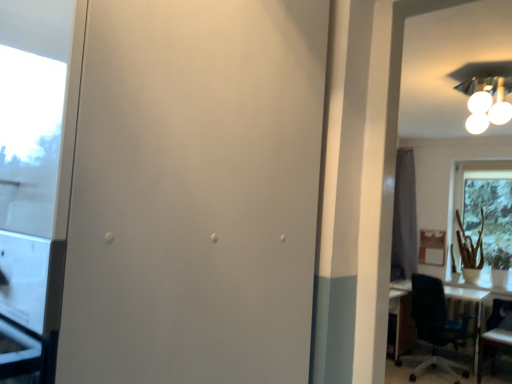
You are a GUI agent. You are given a task and a screenshot of the screen. Output one action in this format:
    pyautogui.click(x=<x>, y=<y>)
    Task: Click on the white glossy light fixture at upper right
    This screenshot has width=512, height=384.
    Given the screenshot: What is the action you would take?
    pyautogui.click(x=486, y=101)

Measure the distance between point (464, 234) and camera.

The depth of point (464, 234) is 18.05 feet.

You are a GUI agent. You are given a task and a screenshot of the screen. Output one action in this format:
    pyautogui.click(x=<x>, y=<y>)
    Task: Click on the black plastic chair at right, the first chair when ordered from left to right
    This screenshot has height=384, width=512.
    Given the screenshot: What is the action you would take?
    pyautogui.click(x=435, y=325)

This screenshot has width=512, height=384. What do you see at coordinates (496, 337) in the screenshot?
I see `wooden chair at right, the first chair positioned from the right` at bounding box center [496, 337].

This screenshot has height=384, width=512. Identify the location of white matte screen door at center. (195, 192).

Is white glossy light fixture at upper right surrounding wooden chair at right, arranged as the second chair when viewed from the left?

Actually, wooden chair at right, arranged as the second chair when viewed from the left, is outside white glossy light fixture at upper right.

Looking at this image, which object is wider, white glossy light fixture at upper right or wooden chair at right, the first chair positioned from the right?

With larger width is wooden chair at right, the first chair positioned from the right.

In the scene shown: Is white glossy light fixture at upper right to the left or to the right of wooden chair at right, arranged as the second chair when viewed from the left, in the image?

white glossy light fixture at upper right is positioned on wooden chair at right, arranged as the second chair when viewed from the left,'s left side.

From the image's perspective, does white glossy light fixture at upper right appear lower than wooden chair at right, arranged as the second chair when viewed from the left?

No, from the image's perspective, white glossy light fixture at upper right is not below wooden chair at right, arranged as the second chair when viewed from the left.

From a real-world perspective, which object rests below the other?

green matte plant at right, from a real-world perspective.

Which is in front, point (462, 234) or point (486, 103)?

The point (486, 103) is in front.

Can we say green matte plant at right lies outside white glossy light fixture at upper right?

green matte plant at right lies outside white glossy light fixture at upper right's area.

From a real-world perspective, is white glossy light fixture at upper right positioned over green matte plant at right based on gravity?

Correct, in the physical world, white glossy light fixture at upper right is higher than green matte plant at right.

Can you confirm if white glossy light fixture at upper right is shorter than green matte plant at right?

Yes.

Is white glossy light fixture at upper right at the right side of green matte plant at right?

Incorrect, white glossy light fixture at upper right is not on the right side of green matte plant at right.

Looking at this image, which of these two, green matte plant at right or wooden chair at right, arranged as the second chair when viewed from the left, is bigger?

Bigger between the two is wooden chair at right, arranged as the second chair when viewed from the left.

At what (x,y) coordinates should I click in order to perform the action: click on chair that is the 1st object located in front of the green matte plant at right. Please return your answer as a coordinate pair (x, y). The width and height of the screenshot is (512, 384). Looking at the image, I should click on (496, 337).

Does black plastic chair at right, the first chair when ordered from left to right, lie in front of green matte plant at right?

Yes, black plastic chair at right, the first chair when ordered from left to right, is in front of green matte plant at right.

From the image's perspective, is black plastic chair at right, the second chair when ordered from right to left, located beneath green matte plant at right?

Correct, black plastic chair at right, the second chair when ordered from right to left, appears lower than green matte plant at right in the image.

From a real-world perspective, is white matte screen door at center above or below green matte plant at right?

white matte screen door at center is situated higher than green matte plant at right in the real world.

Consider the image. Is white matte screen door at center further to the viewer compared to green matte plant at right?

No, white matte screen door at center is closer to the viewer.

Is white matte screen door at center oriented away from green matte plant at right?

Correct, white matte screen door at center is looking away from green matte plant at right.

Based on their sizes in the image, would you say gray fabric curtain at right is bigger or smaller than white matte screen door at center?

Considering their sizes, gray fabric curtain at right takes up less space than white matte screen door at center.

Does point (395, 233) appear closer or farther from the camera than point (242, 242)?

Clearly, point (395, 233) is more distant from the camera than point (242, 242).

Is gray fabric curtain at right inside or outside of white matte screen door at center?

gray fabric curtain at right is outside white matte screen door at center.

Locate an element on the screen. Image resolution: width=512 pixels, height=384 pixels. light fixture on the left of wooden chair at right, arranged as the second chair when viewed from the left is located at coordinates [x=486, y=101].

The image size is (512, 384). I want to click on plant to the right of white glossy light fixture at upper right, so click(x=470, y=251).

From the image, which object appears to be nearer to white glossy light fixture at upper right, white matte screen door at center or wooden chair at right, the first chair positioned from the right?

wooden chair at right, the first chair positioned from the right.

Looking at the image, which one is located closer to gray fabric curtain at right, wooden chair at right, the first chair positioned from the right, or white matte screen door at center?

Based on the image, wooden chair at right, the first chair positioned from the right, appears to be nearer to gray fabric curtain at right.

Looking at the image, which one is located further to green matte plant at right, gray fabric curtain at right or white matte screen door at center?

white matte screen door at center lies further to green matte plant at right than the other object.

Looking at the image, which one is located closer to white glossy light fixture at upper right, white matte screen door at center or green matte plant at right?

Among the two, green matte plant at right is located nearer to white glossy light fixture at upper right.

Looking at the image, which one is located further to wooden chair at right, the first chair positioned from the right, black plastic chair at right, the first chair when ordered from left to right, or white glossy light fixture at upper right?

white glossy light fixture at upper right lies further to wooden chair at right, the first chair positioned from the right, than the other object.

Which object lies nearer to the anchor point green matte plant at right, wooden chair at right, arranged as the second chair when viewed from the left, or black plastic chair at right, the second chair when ordered from right to left?

The object closer to green matte plant at right is black plastic chair at right, the second chair when ordered from right to left.

Based on their spatial positions, is white glossy light fixture at upper right or gray fabric curtain at right further from white matte screen door at center?

The object further to white matte screen door at center is gray fabric curtain at right.

When comparing their distances from wooden chair at right, the first chair positioned from the right, does white glossy light fixture at upper right or transparent glass window at right seem closer?

transparent glass window at right lies closer to wooden chair at right, the first chair positioned from the right, than the other object.

Find the location of a particular element. plant positioned between white matte screen door at center and gray fabric curtain at right from near to far is located at coordinates (470, 251).

The image size is (512, 384). Identify the location of window between white glossy light fixture at upper right and black plastic chair at right, the second chair when ordered from right to left, in the up-down direction. [487, 207].

Identify the location of window located between black plastic chair at right, the first chair when ordered from left to right, and gray fabric curtain at right in the depth direction. This screenshot has width=512, height=384. (487, 207).

What are the coordinates of `plant between white matte screen door at center and transparent glass window at right along the z-axis` in the screenshot? It's located at (470, 251).